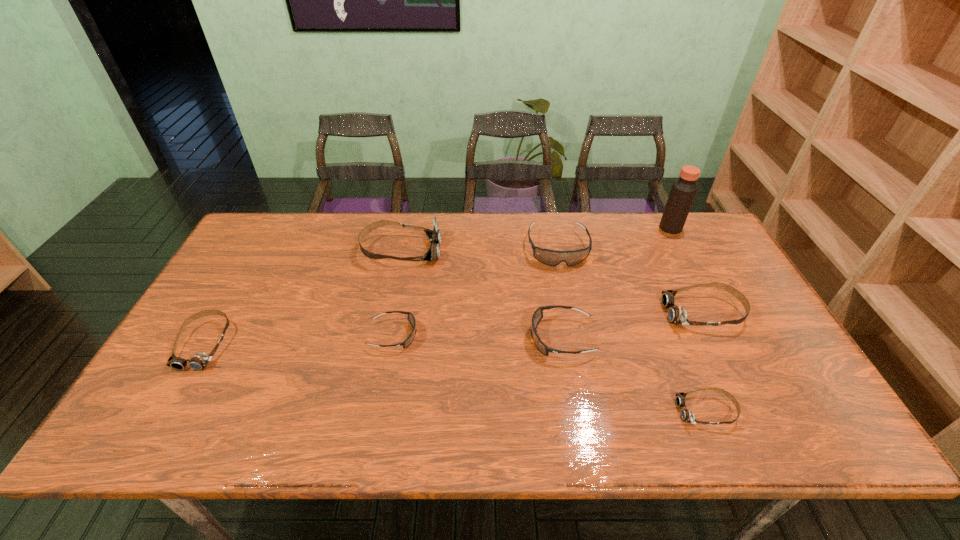
Where is `unoccupied area between the vinegar and the biggest brown goggles`? The height and width of the screenshot is (540, 960). unoccupied area between the vinegar and the biggest brown goggles is located at coordinates (536, 239).

Locate an element on the screen. free space between the leftmost black goggles and the farthest brown goggles is located at coordinates (397, 293).

Identify the location of vacant point located between the vinegar and the second biggest black goggles. The image size is (960, 540). (616, 283).

The height and width of the screenshot is (540, 960). Identify the location of free space between the vinegar and the nearest brown goggles. (688, 320).

The height and width of the screenshot is (540, 960). Find the location of `vacant point located between the second biggest black goggles and the biggest brown goggles`. vacant point located between the second biggest black goggles and the biggest brown goggles is located at coordinates (481, 294).

Locate an element on the screen. free space that is in between the leftmost black goggles and the biggest brown goggles is located at coordinates (397, 293).

I want to click on free space between the brown vinegar and the smallest black goggles, so click(x=532, y=282).

Locate an element on the screen. free space that is in between the second smallest black goggles and the third brown goggles from right to left is located at coordinates (481, 294).

Locate an element on the screen. The width and height of the screenshot is (960, 540). object that is the third closest to the biggest black goggles is located at coordinates (683, 191).

This screenshot has width=960, height=540. Identify the location of object that can be found as the fourth closest to the farthest black goggles. (434, 235).